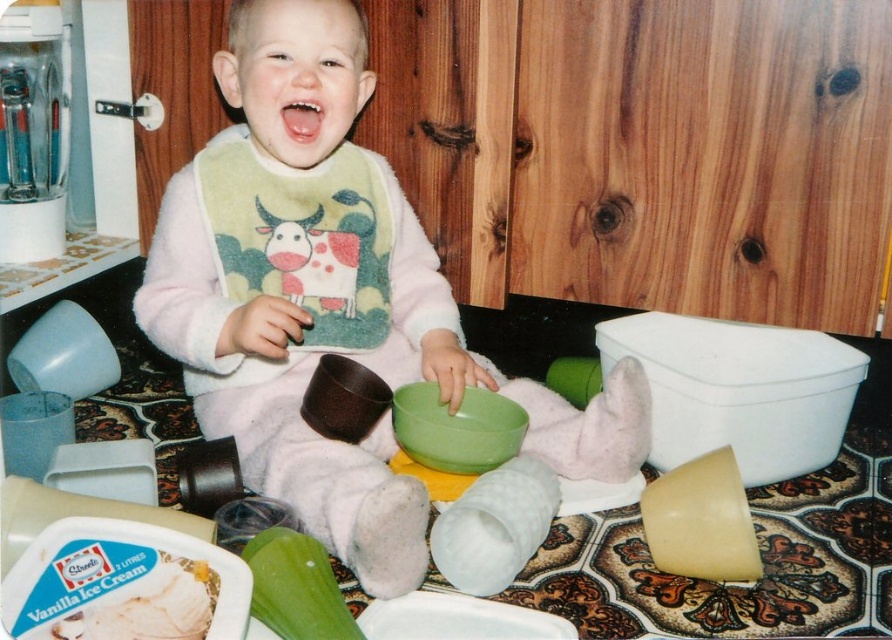
Who is lower down, pink fleece bib at center or pink matte mouth at center?

pink fleece bib at center is below.

Does pink fleece bib at center have a greater width compared to pink matte mouth at center?

Yes.

Image resolution: width=892 pixels, height=640 pixels. What do you see at coordinates (329, 300) in the screenshot?
I see `pink fleece bib at center` at bounding box center [329, 300].

Locate an element on the screen. This screenshot has width=892, height=640. pink fleece bib at center is located at coordinates (329, 300).